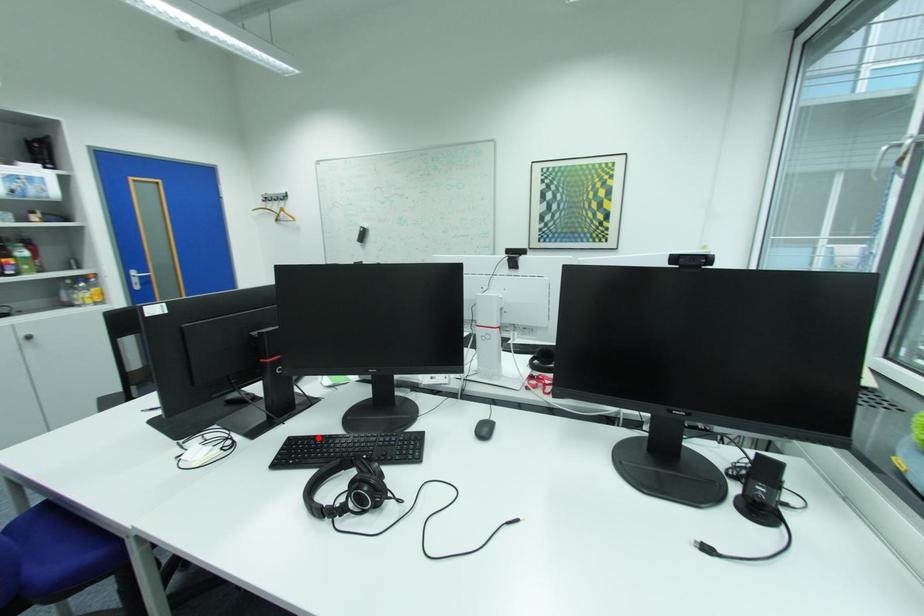
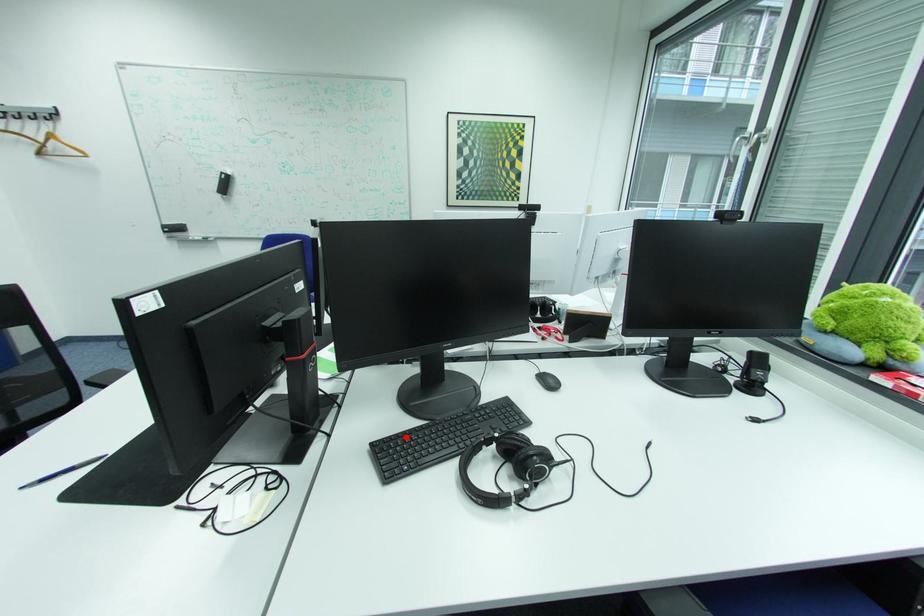
I am providing you with two images of the same scene from different viewpoints. A red point is marked on the first image and another point is marked on the second image. Is the marked point in image1 the same physical position as the marked point in image2?

Yes